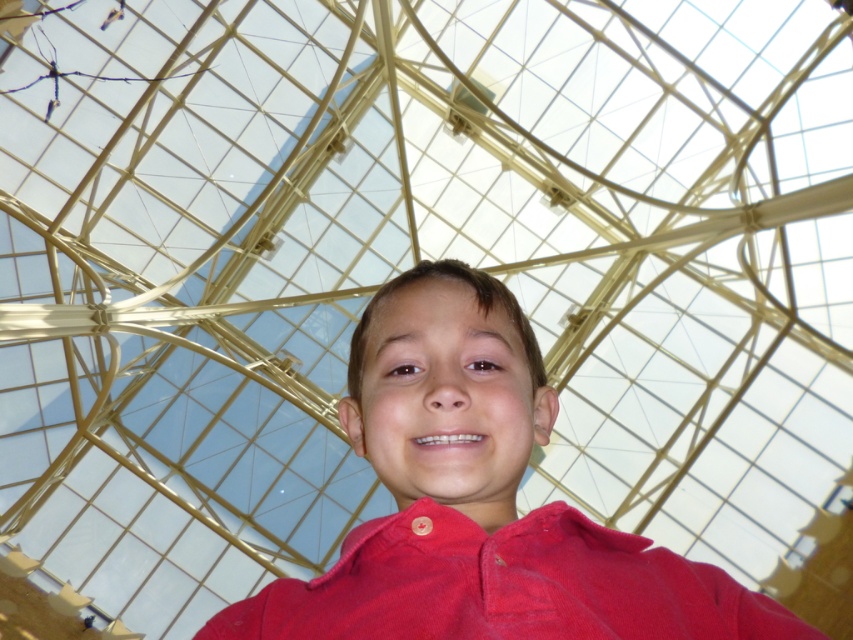
This screenshot has height=640, width=853. Describe the element at coordinates (479, 500) in the screenshot. I see `red matte shirt at center` at that location.

Is point (653, 589) more distant than point (537, 531)?

No, (653, 589) is in front of (537, 531).

I want to click on red matte shirt at center, so click(x=479, y=500).